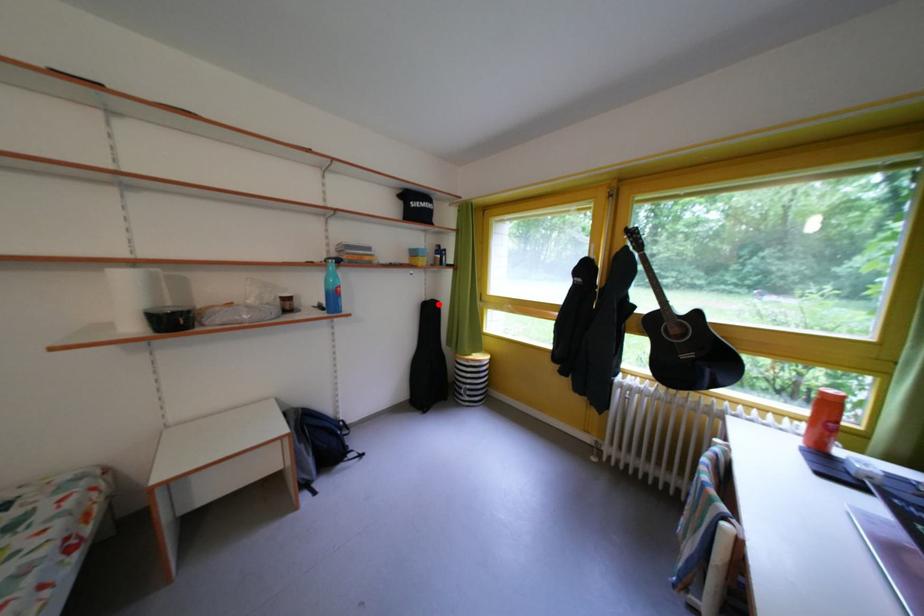
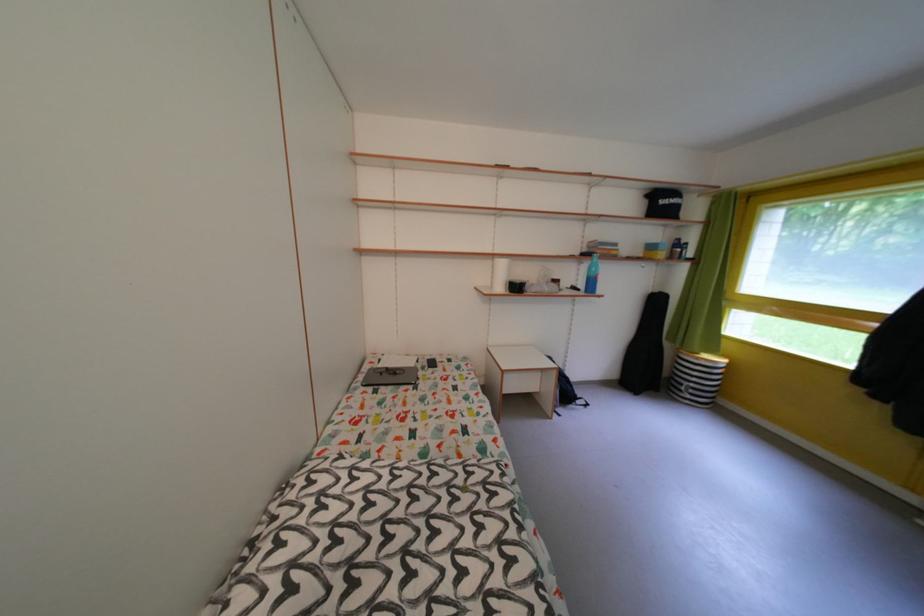
Locate, in the second image, the point that corresponds to the highlighted location in the first image.

(665, 296)